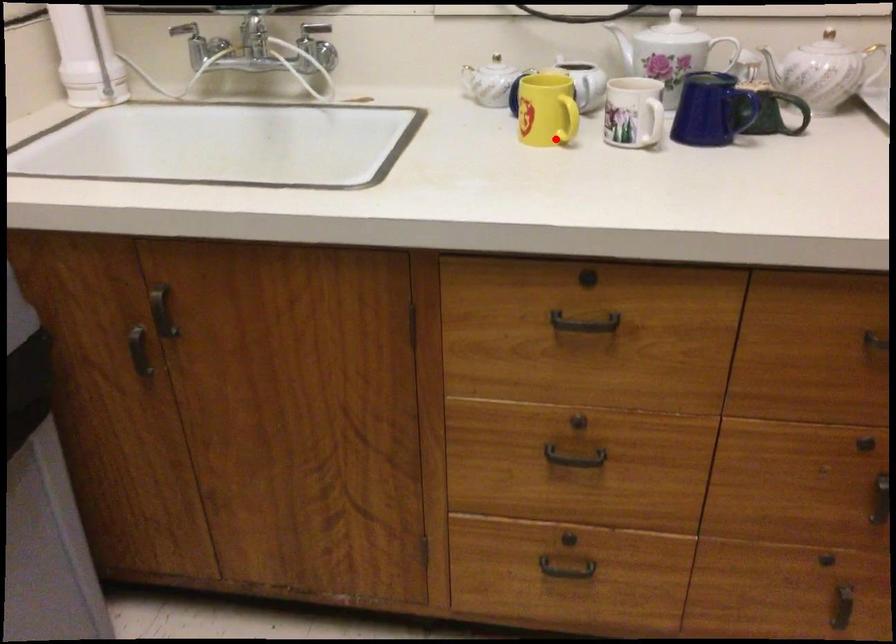
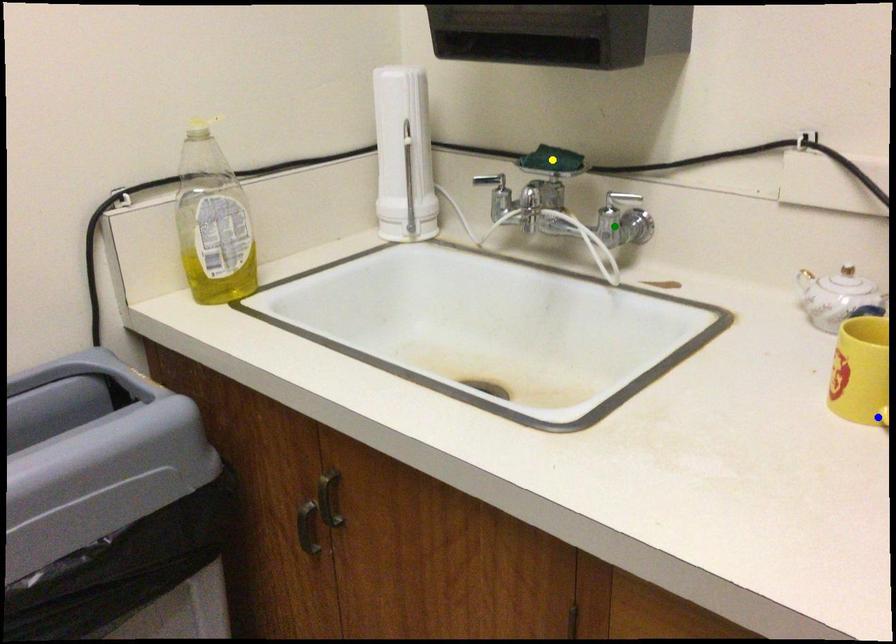
Question: I am providing you with two images of the same scene from different viewpoints. A red point is marked on the first image. You are given multiple points on the second image. Which point in image 2 represents the same 3d spot as the red point in image 1?

Choices:
 (A) blue point
 (B) green point
 (C) yellow point

Answer: (A)